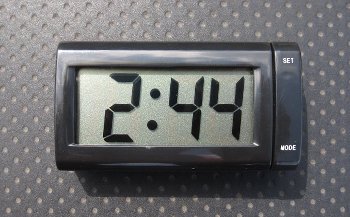
Identify the location of screen. This screenshot has height=217, width=350. (227, 80).